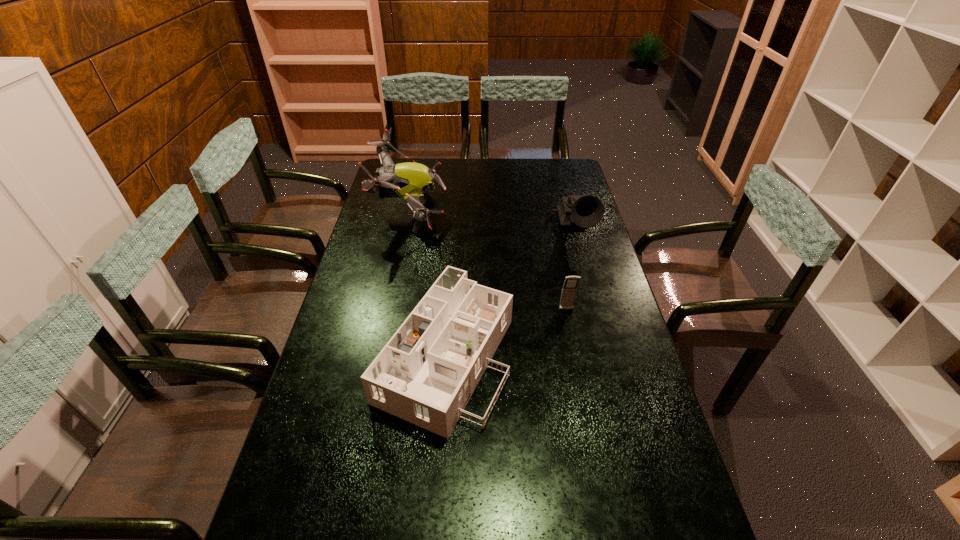
The width and height of the screenshot is (960, 540). In order to click on vacant area that satisfies the following two spatial constraints: 1. on the front-facing side of the shortest object; 2. on the left side of the tallest object in this screenshot , I will do `click(379, 355)`.

You are a GUI agent. You are given a task and a screenshot of the screen. Output one action in this format:
    pyautogui.click(x=<x>, y=<y>)
    Task: Click on the vacant position in the image that satisfies the following two spatial constraints: 1. on the front-facing side of the dollhouse; 2. on the right side of the drone
    The width and height of the screenshot is (960, 540).
    Given the screenshot: What is the action you would take?
    pyautogui.click(x=379, y=355)

Find the location of a particular element. vacant point that satisfies the following two spatial constraints: 1. on the back side of the shortest object; 2. on the front-facing side of the drone is located at coordinates (456, 211).

Locate an element on the screen. Image resolution: width=960 pixels, height=540 pixels. blank area in the image that satisfies the following two spatial constraints: 1. on the front-facing side of the tallest object; 2. on the back side of the dollhouse is located at coordinates (379, 355).